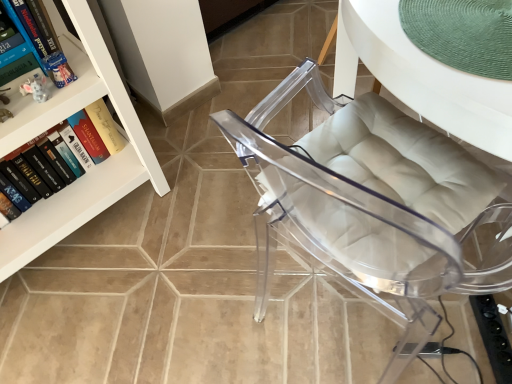
Question: Would you consider transparent acrylic chair at center to be distant from hardcover book at upper left, which appears as the first book when viewed from the top?

Choices:
 (A) no
 (B) yes

Answer: (A)

Question: Is transparent acrylic chair at center wider than hardcover book at upper left, arranged as the 2th book when ordered from the bottom?

Choices:
 (A) no
 (B) yes

Answer: (B)

Question: Does transparent acrylic chair at center turn towards hardcover book at upper left, arranged as the 2th book when ordered from the bottom?

Choices:
 (A) no
 (B) yes

Answer: (A)

Question: Does transparent acrylic chair at center contain hardcover book at upper left, which appears as the first book when viewed from the top?

Choices:
 (A) yes
 (B) no

Answer: (B)

Question: Is transparent acrylic chair at center bigger than hardcover book at upper left, arranged as the 2th book when ordered from the bottom?

Choices:
 (A) no
 (B) yes

Answer: (B)

Question: Is green woven placemat at upper right in front of or behind transparent acrylic chair at center in the image?

Choices:
 (A) front
 (B) behind

Answer: (B)

Question: From the image's perspective, is green woven placemat at upper right above or below transparent acrylic chair at center?

Choices:
 (A) below
 (B) above

Answer: (B)

Question: Based on their sizes in the image, would you say green woven placemat at upper right is bigger or smaller than transparent acrylic chair at center?

Choices:
 (A) big
 (B) small

Answer: (B)

Question: From a real-world perspective, is green woven placemat at upper right above or below transparent acrylic chair at center?

Choices:
 (A) below
 (B) above

Answer: (B)

Question: Is hardcover book at upper left, which appears as the first book when viewed from the top, inside or outside of green woven placemat at upper right?

Choices:
 (A) outside
 (B) inside

Answer: (A)

Question: Does point (27, 31) appear closer or farther from the camera than point (496, 142)?

Choices:
 (A) closer
 (B) farther

Answer: (B)

Question: Would you say hardcover book at upper left, which appears as the first book when viewed from the top, is to the left or to the right of green woven placemat at upper right in the picture?

Choices:
 (A) right
 (B) left

Answer: (B)

Question: In the image, is hardcover book at upper left, arranged as the 2th book when ordered from the bottom, positioned in front of or behind green woven placemat at upper right?

Choices:
 (A) front
 (B) behind

Answer: (B)

Question: From their relative heights in the image, would you say white glossy bookcase at upper left is taller or shorter than transparent acrylic chair at center?

Choices:
 (A) tall
 (B) short

Answer: (A)

Question: Considering the positions of white glossy bookcase at upper left and transparent acrylic chair at center in the image, is white glossy bookcase at upper left wider or thinner than transparent acrylic chair at center?

Choices:
 (A) thin
 (B) wide

Answer: (A)